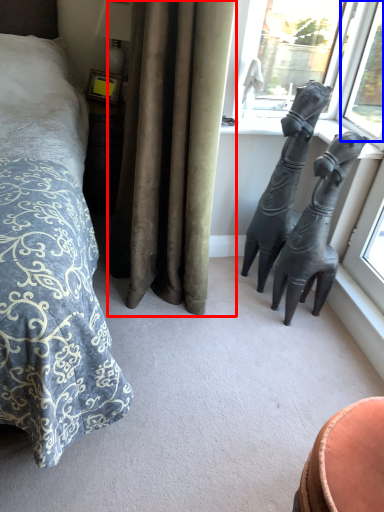
Question: Which object appears closest to the camera in this image, curtain (highlighted by a red box) or window (highlighted by a blue box)?

Choices:
 (A) curtain
 (B) window

Answer: (A)